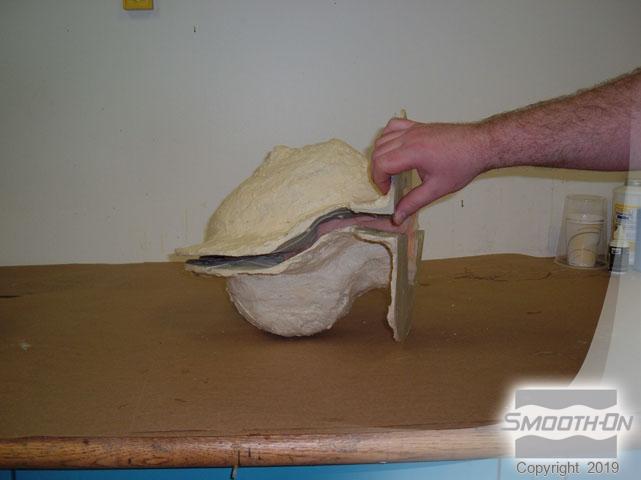
Identify the location of white plastic cup upside down. (588, 205).